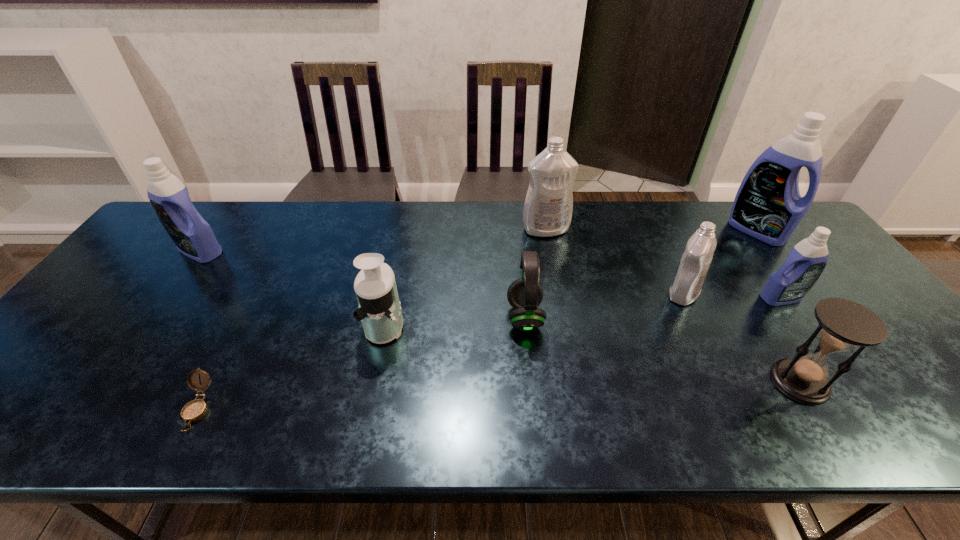
Locate an element on the screen. Image resolution: width=960 pixels, height=540 pixels. the tallest object is located at coordinates (768, 206).

Where is `the biggest blue detergent`? The image size is (960, 540). the biggest blue detergent is located at coordinates (768, 206).

You are a GUI agent. You are given a task and a screenshot of the screen. Output one action in this format:
    pyautogui.click(x=<x>, y=<y>)
    Task: Click on the fourth detergent from right to left
    This screenshot has width=960, height=540.
    Given the screenshot: What is the action you would take?
    pyautogui.click(x=548, y=207)

Image resolution: width=960 pixels, height=540 pixels. I want to click on the farther white detergent, so click(x=548, y=207).

Locate an element on the screen. The image size is (960, 540). the leftmost object is located at coordinates (192, 235).

Identify the location of the leftmost blue detergent. The image size is (960, 540). (192, 235).

This screenshot has width=960, height=540. What are the coordinates of `juicer` in the screenshot? It's located at coord(379,310).

Locate an element on the screen. The width and height of the screenshot is (960, 540). the right white detergent is located at coordinates (691, 272).

Where is `the third detergent from right to left`? The height and width of the screenshot is (540, 960). the third detergent from right to left is located at coordinates (691, 272).

At what (x,y) coordinates should I click in order to perform the action: click on the nearest blue detergent. Please return your answer as a coordinate pair (x, y). Looking at the image, I should click on (806, 261).